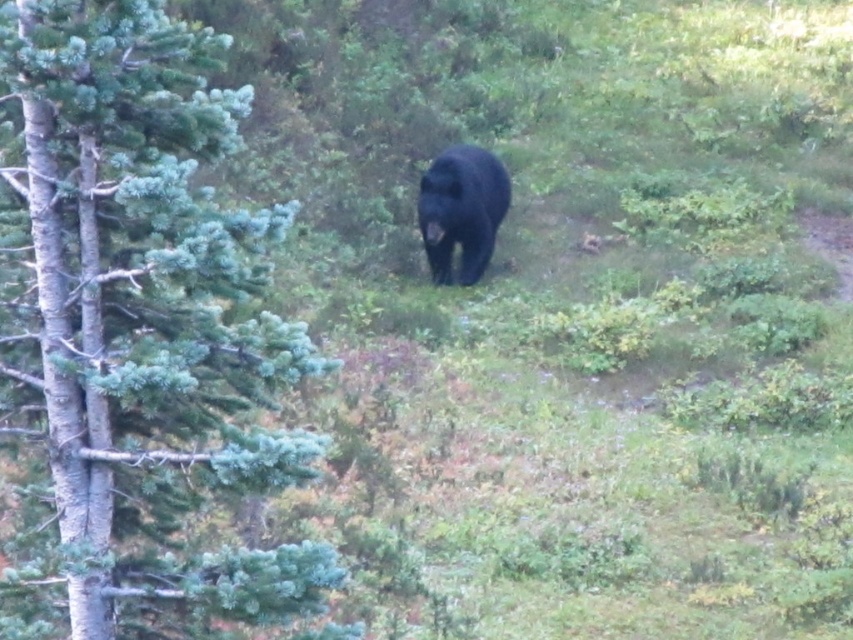
Question: Which of the following is the farthest from the observer?

Choices:
 (A) black furry bear at center
 (B) green matte tree at center-left

Answer: (A)

Question: Does green matte tree at center-left appear on the right side of black furry bear at center?

Choices:
 (A) yes
 (B) no

Answer: (B)

Question: Is green matte tree at center-left above black furry bear at center?

Choices:
 (A) yes
 (B) no

Answer: (B)

Question: In this image, where is green matte tree at center-left located relative to black furry bear at center?

Choices:
 (A) below
 (B) above

Answer: (A)

Question: Which of the following is the closest to the observer?

Choices:
 (A) (503, 214)
 (B) (215, 634)

Answer: (B)